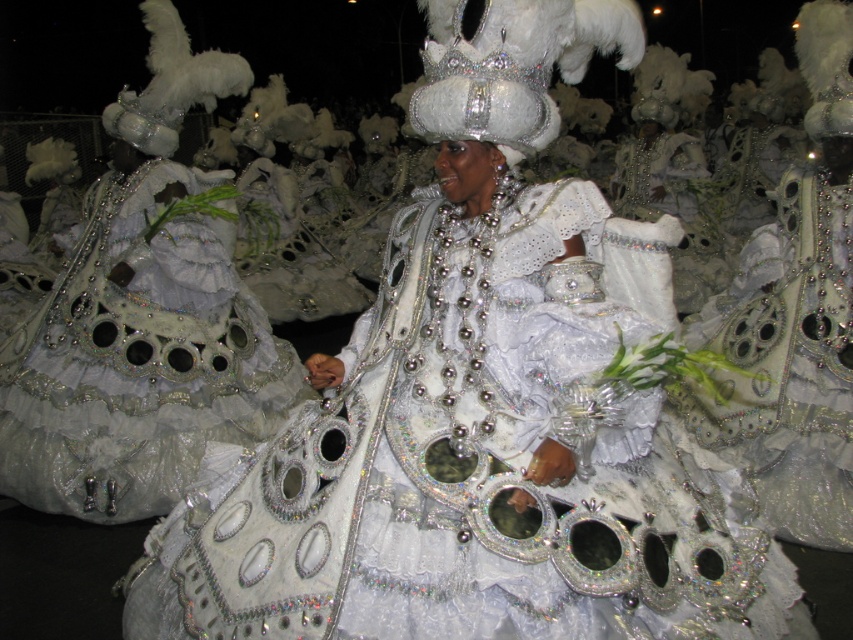
Question: Is sparkly silver dress at center in front of white sequined crown at center?

Choices:
 (A) no
 (B) yes

Answer: (A)

Question: Can you confirm if glittery white dress at center is positioned below white sequined crown at center?

Choices:
 (A) yes
 (B) no

Answer: (A)

Question: Estimate the real-world distances between objects in this image. Which object is closer to the sparkly silver dress at center?

Choices:
 (A) white sequined crown at center
 (B) shiny silver gown at center
 (C) glittery white dress at center

Answer: (C)

Question: Considering the real-world distances, which object is farthest from the glittery white dress at center?

Choices:
 (A) white sequined crown at center
 (B) sparkly silver dress at center

Answer: (B)

Question: Which object is closer to the camera taking this photo?

Choices:
 (A) sparkly silver dress at center
 (B) glittery white dress at center
 (C) shiny silver gown at center

Answer: (B)

Question: Where is shiny silver gown at center located in relation to white sequined crown at center in the image?

Choices:
 (A) left
 (B) right

Answer: (A)